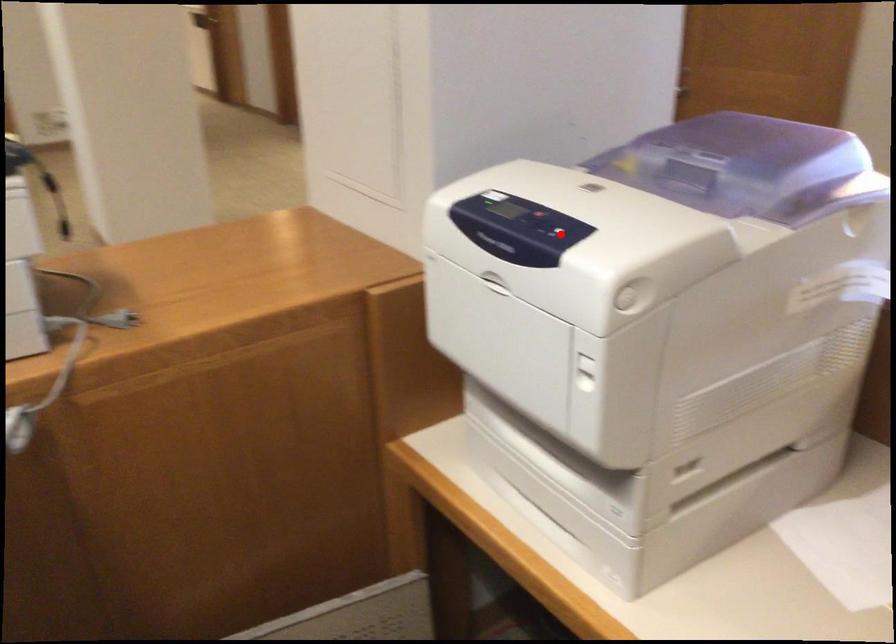
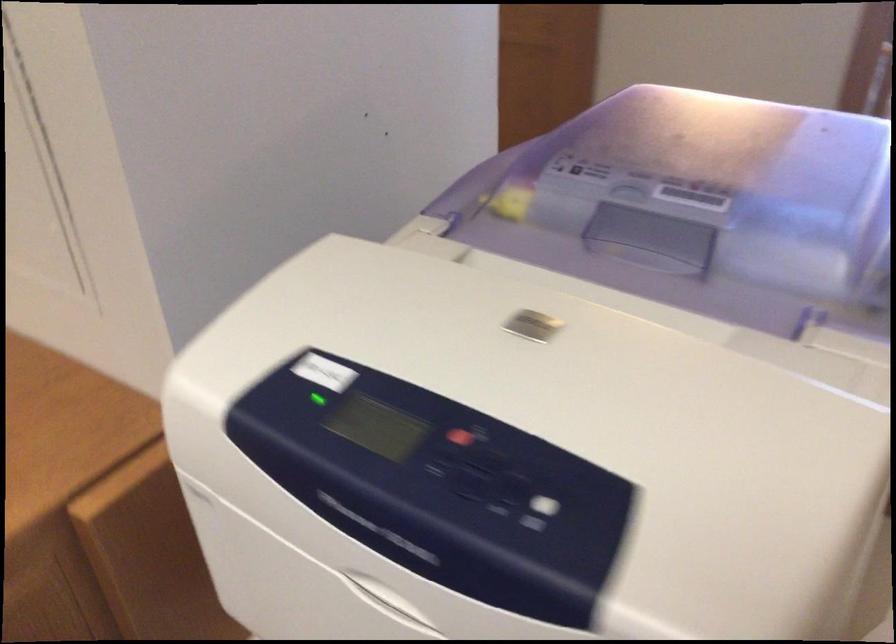
Question: I am providing you with two images of the same scene from different viewpoints. Given a red point in image1, look at the same physical point in image2. Is it:

Choices:
 (A) Closer to the viewpoint
 (B) Farther from the viewpoint

Answer: (A)